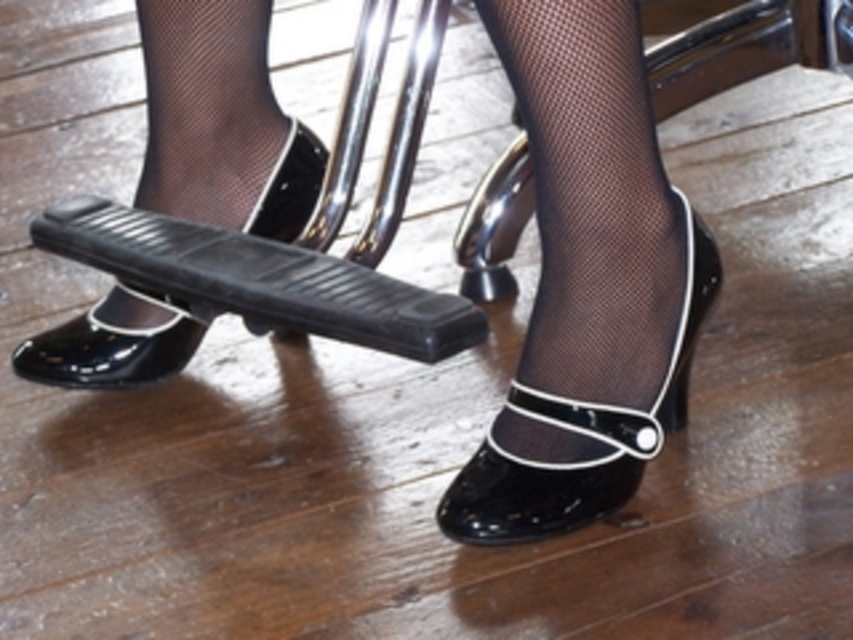
Between black patent leather shoe at center and glossy patent leather shoe at lower left, which one has less height?

glossy patent leather shoe at lower left is shorter.

Can you confirm if black patent leather shoe at center is wider than glossy patent leather shoe at lower left?

No.

The height and width of the screenshot is (640, 853). What are the coordinates of `black patent leather shoe at center` in the screenshot? It's located at (581, 435).